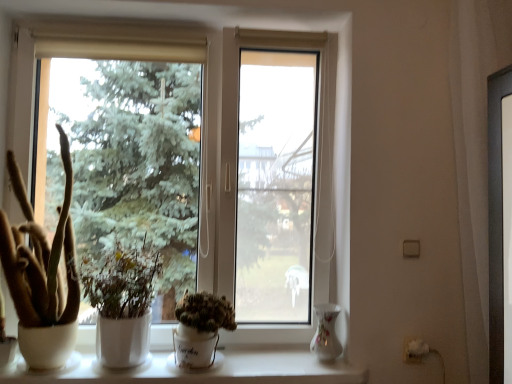
Locate an element on the screen. free space that is in between green matte cactus at center, the 3th houseplant viewed from the left, and porcelain floral vase at lower right is located at coordinates (272, 364).